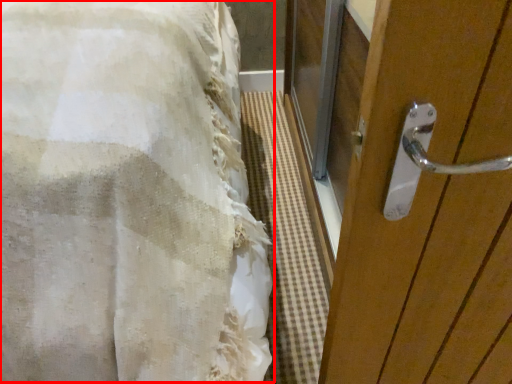
Question: In this image, where is bed (annotated by the red box) located relative to door?

Choices:
 (A) right
 (B) left

Answer: (B)